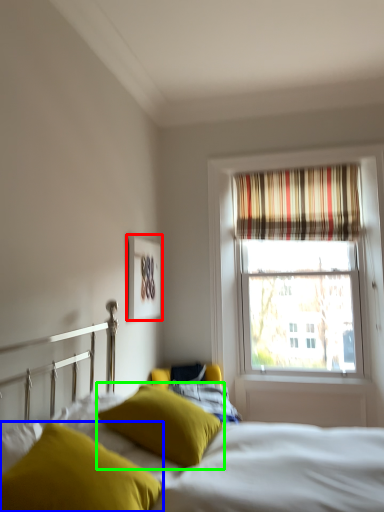
Question: Which object is the farthest from picture frame (highlighted by a red box)? Choose among these: pillow (highlighted by a blue box) or pillow (highlighted by a green box).

Choices:
 (A) pillow
 (B) pillow

Answer: (A)